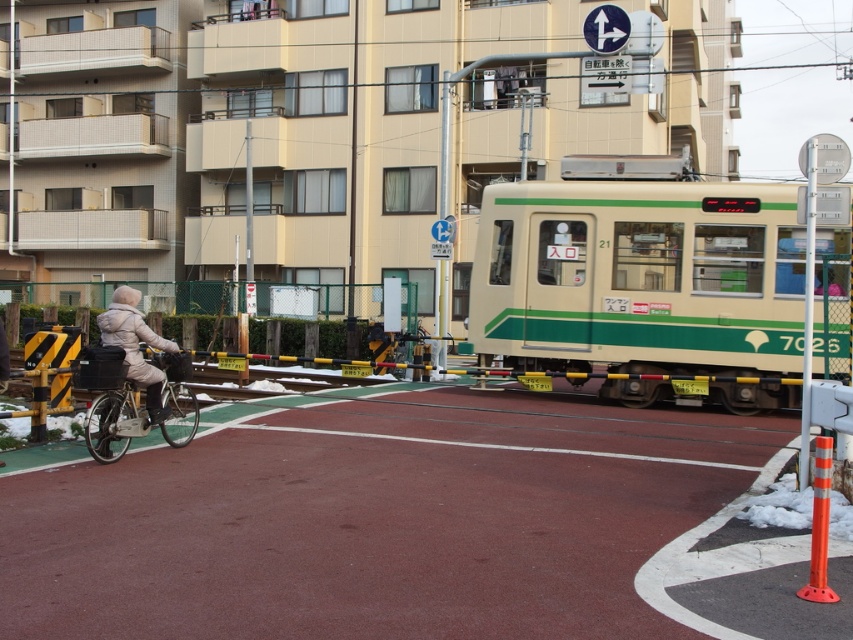
Question: Can you confirm if green matte train at center is wider than beige puffy jacket at left?

Choices:
 (A) no
 (B) yes

Answer: (B)

Question: Where is green matte train at center located in relation to matte black bicycle at left in the image?

Choices:
 (A) below
 (B) above

Answer: (B)

Question: Which object is the farthest from the beige puffy jacket at left?

Choices:
 (A) matte black bicycle at left
 (B) green matte train at center

Answer: (B)

Question: Which object is positioned closest to the matte black bicycle at left?

Choices:
 (A) beige puffy jacket at left
 (B) green matte train at center

Answer: (A)

Question: Which point is farther from the camera taking this photo?

Choices:
 (A) (166, 432)
 (B) (126, 340)

Answer: (A)

Question: Is green matte train at center wider than matte black bicycle at left?

Choices:
 (A) no
 (B) yes

Answer: (B)